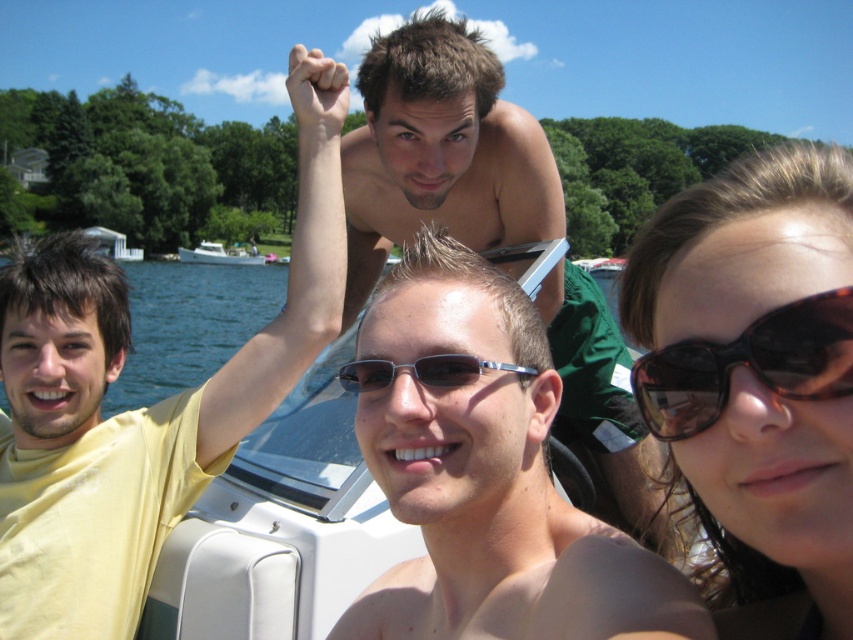
What is located at the coordinates point [422,371] in the image?

The sunglasses at center are located at point [422,371].

You are a photographer trying to capture a clear portrait of the two people in the boat. You notice the shiny brown hair at upper center and the sunglasses at center. Which object should you adjust your focus on to ensure the subject is in focus, considering their sizes?

The shiny brown hair at upper center is wider than the sunglasses at center, so focusing on the shiny brown hair at upper center would ensure the subject is in focus due to its larger size.

You are a photographer trying to capture the perfect shot of the shiny brown hair at upper center. Based on its coordinates in the image, where should you position your camera to ensure it is centered in your viewfinder?

Since the shiny brown hair at upper center is located at coordinates point (440,152), you should position your camera slightly to the left and lower the angle slightly to center it in the viewfinder.